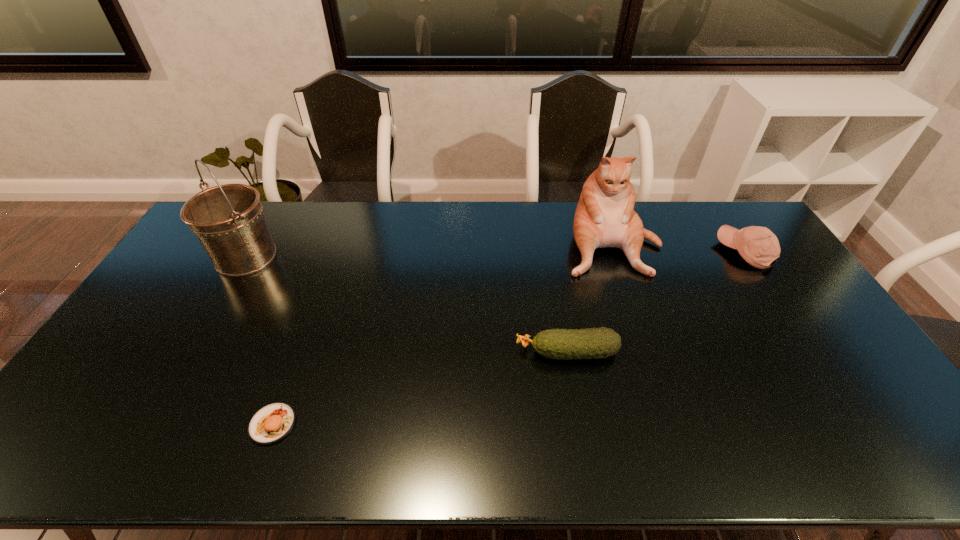
At what (x,y) coordinates should I click in order to perform the action: click on object that stands as the second closest to the second nearest object. Please return your answer as a coordinate pair (x, y). Looking at the image, I should click on (758, 246).

Find the location of `vacant region that satisfies the following two spatial constraints: 1. on the front-facing side of the third shortest object; 2. on the front side of the bucket`. vacant region that satisfies the following two spatial constraints: 1. on the front-facing side of the third shortest object; 2. on the front side of the bucket is located at coordinates (748, 257).

Where is `vacant space that satisfies the following two spatial constraints: 1. on the front-facing side of the rightmost object; 2. on the front side of the shortest object`? This screenshot has width=960, height=540. vacant space that satisfies the following two spatial constraints: 1. on the front-facing side of the rightmost object; 2. on the front side of the shortest object is located at coordinates (858, 424).

At what (x,y) coordinates should I click in order to perform the action: click on vacant space that satisfies the following two spatial constraints: 1. on the front-facing side of the rightmost object; 2. on the front side of the shortest object. Please return your answer as a coordinate pair (x, y). Looking at the image, I should click on click(858, 424).

Locate an element on the screen. This screenshot has height=540, width=960. vacant space that satisfies the following two spatial constraints: 1. on the face of the cat; 2. at the blossom end of the fourth tallest object is located at coordinates (648, 352).